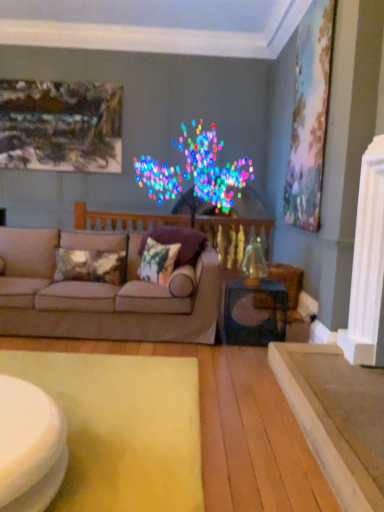
Question: From a real-world perspective, is smooth white table at lower left above or below metallic silver picture frame at upper left, placed as the 2th picture frame when sorted from front to back?

Choices:
 (A) above
 (B) below

Answer: (B)

Question: Would you say smooth white table at lower left is inside or outside metallic silver picture frame at upper left, placed as the 2th picture frame when sorted from front to back?

Choices:
 (A) inside
 (B) outside

Answer: (B)

Question: Estimate the real-world distances between objects in this image. Which object is closer to the velvet floral pillow at center, the first pillow in the right-to-left sequence?

Choices:
 (A) beige fabric couch at center
 (B) pastel canvas painting at upper right, positioned as the first picture frame in front-to-back order
 (C) wooden balustrade at center
 (D) metallic sheen pillow at center, marked as the first pillow in a left-to-right arrangement
 (E) textured floral pillow at center, which appears as the 2th pillow when viewed from the left

Answer: (E)

Question: Estimate the real-world distances between objects in this image. Which object is farther from the beige fabric couch at center?

Choices:
 (A) smooth white table at lower left
 (B) pastel canvas painting at upper right, the 1th picture frame positioned from the right
 (C) metallic silver picture frame at upper left, placed as the 2th picture frame when sorted from front to back
 (D) velvet floral pillow at center, the 3th pillow positioned from the left
 (E) yellow felt mat at lower left

Answer: (C)